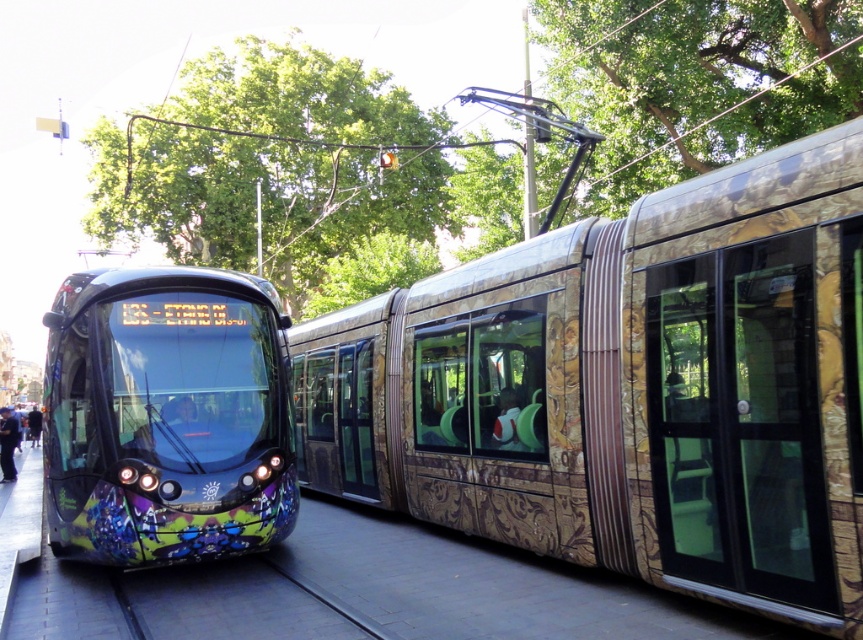
Question: Which is farther from the metallic blue coach at lower left?

Choices:
 (A) gold-patterned tram at center
 (B) graffiti-covered glass train at left
 (C) gray concrete track at lower center

Answer: (C)

Question: Among these points, which one is farthest from the camera?

Choices:
 (A) tap(244, 285)
 (B) tap(11, 452)
 (C) tap(243, 592)

Answer: (B)

Question: Can you confirm if gold-patterned tram at center is smaller than gray concrete track at lower center?

Choices:
 (A) yes
 (B) no

Answer: (B)

Question: Which point is farther to the camera?

Choices:
 (A) (313, 432)
 (B) (14, 442)
 (C) (279, 595)

Answer: (B)

Question: Is gray concrete track at lower center to the right of metallic blue coach at lower left from the viewer's perspective?

Choices:
 (A) yes
 (B) no

Answer: (A)

Question: Can you confirm if gold-patterned tram at center is wider than gray concrete track at lower center?

Choices:
 (A) yes
 (B) no

Answer: (A)